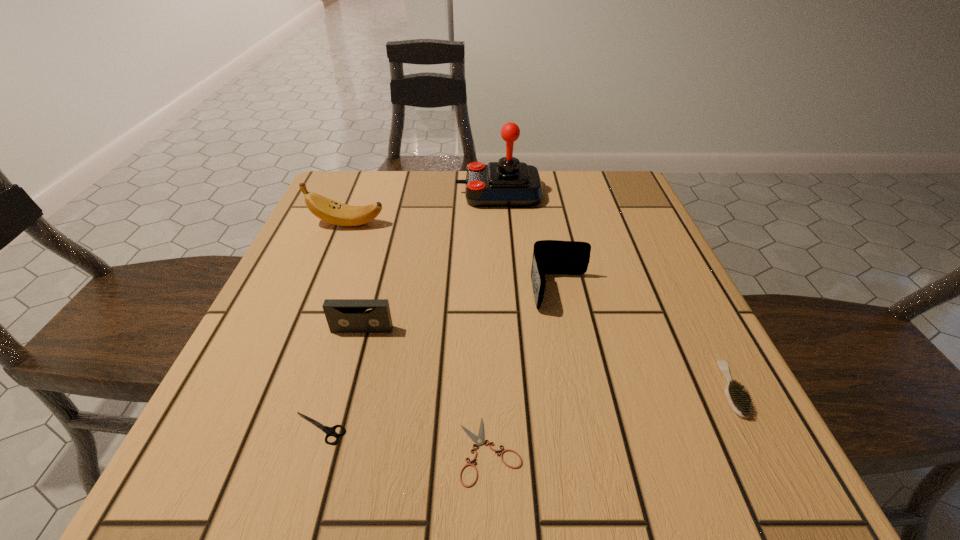
Find the location of a particular element. object that is at the near left corner is located at coordinates (330, 431).

Identify the location of vacant space at the far edge. This screenshot has width=960, height=540. (514, 207).

I want to click on free space at the near edge of the desktop, so click(486, 455).

Where is `free location at the left edge`? The width and height of the screenshot is (960, 540). free location at the left edge is located at coordinates (333, 295).

In the image, there is a desktop. In order to click on free region at the right edge in this screenshot , I will do `click(660, 334)`.

Locate an element on the screen. vacant space at the far left corner of the desktop is located at coordinates (359, 173).

Image resolution: width=960 pixels, height=540 pixels. In the image, there is a desktop. Find the location of `vacant region at the near left corner`. vacant region at the near left corner is located at coordinates (230, 466).

This screenshot has width=960, height=540. In the image, there is a desktop. In order to click on free space at the far right corner in this screenshot , I will do `click(629, 207)`.

Image resolution: width=960 pixels, height=540 pixels. In the image, there is a desktop. In order to click on vacant space at the near right corner in this screenshot , I will do `click(693, 436)`.

Identify the location of free space between the second shortest object and the third farthest object. (440, 360).